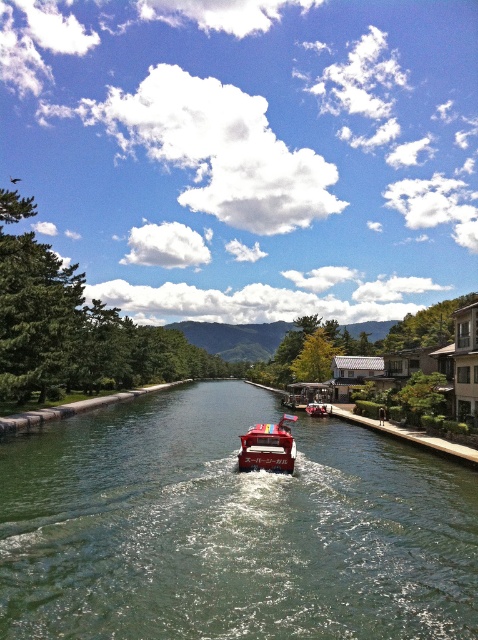
Question: Is the position of green glossy water at center less distant than that of metallic red boat at center?

Choices:
 (A) yes
 (B) no

Answer: (A)

Question: Which point appears farthest from the camera in this image?

Choices:
 (A) (264, 424)
 (B) (0, 529)
 (C) (315, 404)

Answer: (C)

Question: Does green glossy water at center have a greater width compared to red glossy boat at center?

Choices:
 (A) no
 (B) yes

Answer: (B)

Question: Can you confirm if green glossy water at center is positioned above red glossy boat at center?

Choices:
 (A) yes
 (B) no

Answer: (A)

Question: Which object is positioned farthest from the metallic red boat at center?

Choices:
 (A) green glossy water at center
 (B) red glossy boat at center

Answer: (B)

Question: Among these objects, which one is nearest to the camera?

Choices:
 (A) green glossy water at center
 (B) red glossy boat at center

Answer: (A)